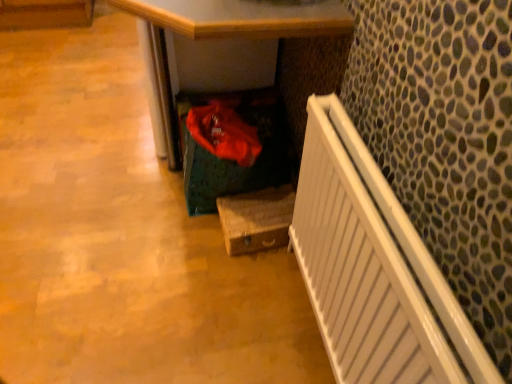
Image resolution: width=512 pixels, height=384 pixels. Find the location of `free space in front of wooden at lower center`. free space in front of wooden at lower center is located at coordinates (125, 264).